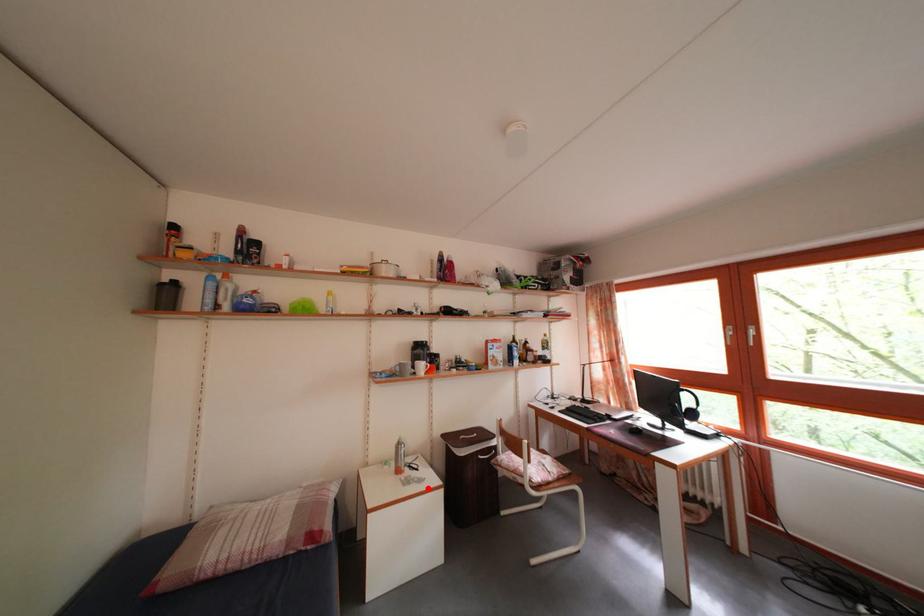
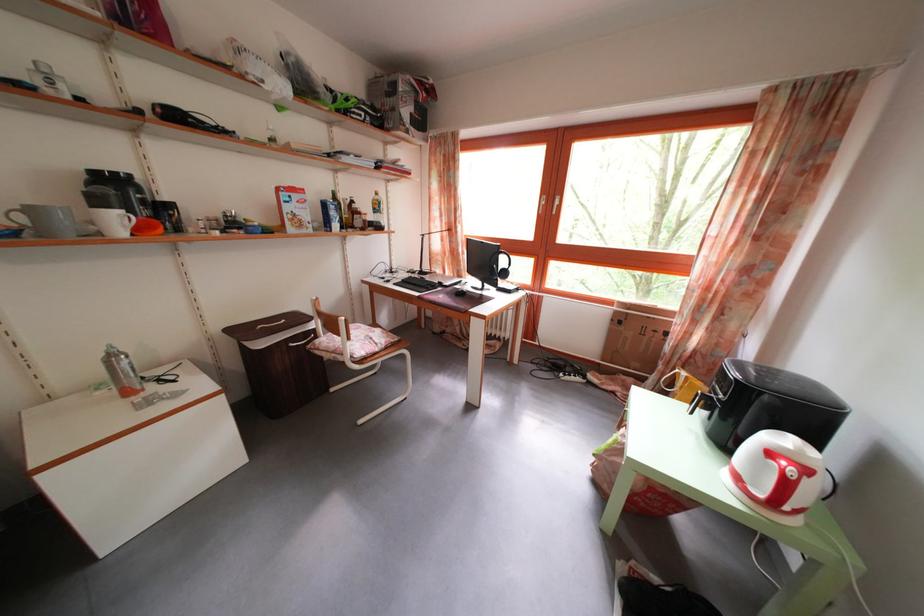
In the second image, find the point that corresponds to the highlighted location in the first image.

(185, 402)